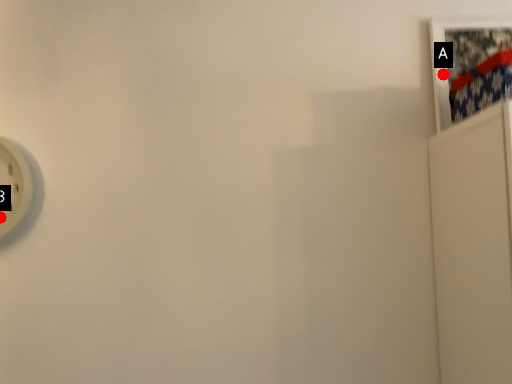
Question: Two points are circled on the image, labeled by A and B beside each circle. Which point is farther from the camera taking this photo?

Choices:
 (A) A is further
 (B) B is further

Answer: (A)